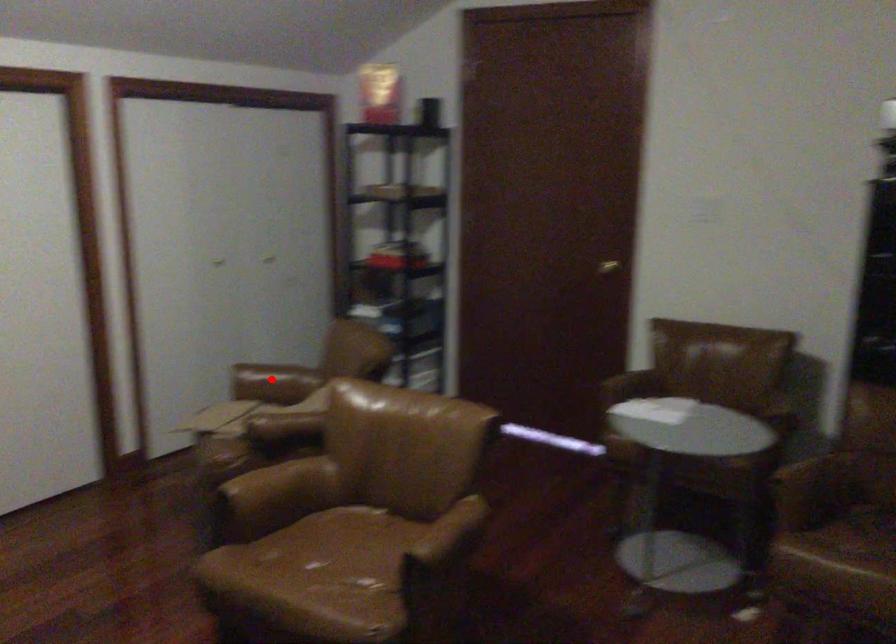
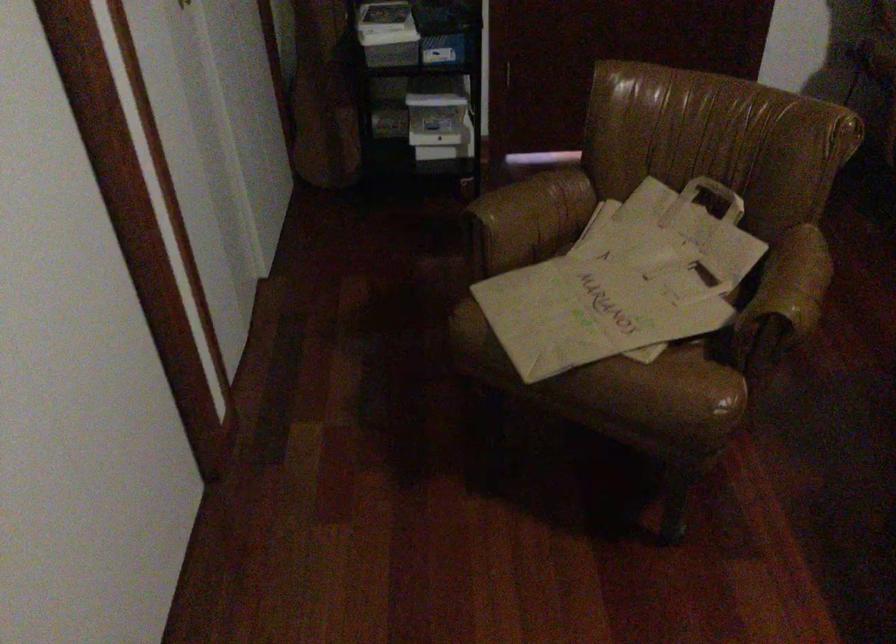
The point at the highlighted location is marked in the first image. Where is the corresponding point in the second image?

(532, 216)